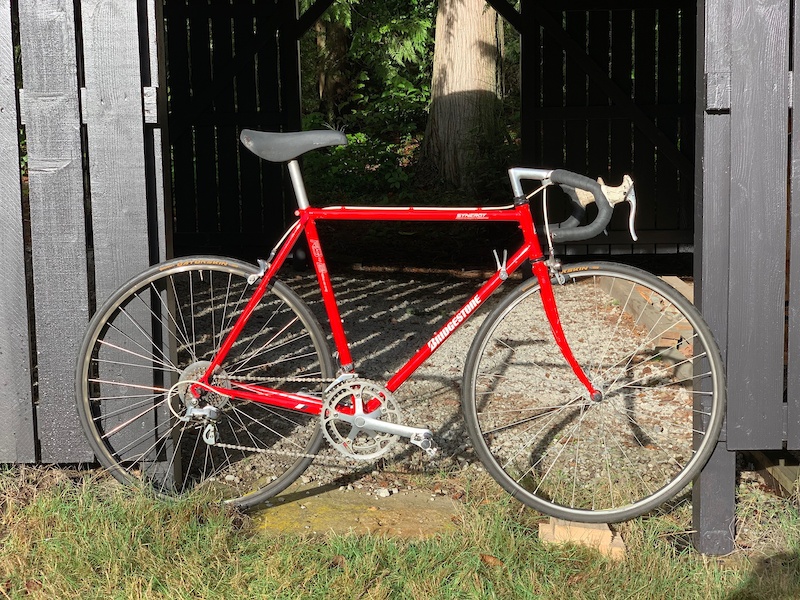
Image resolution: width=800 pixels, height=600 pixels. Find the location of `seat`. seat is located at coordinates (293, 141).